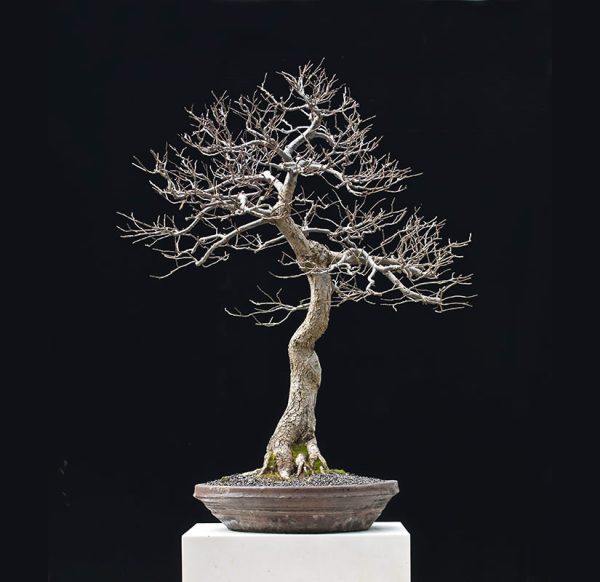
I want to click on planter, so click(x=334, y=510).